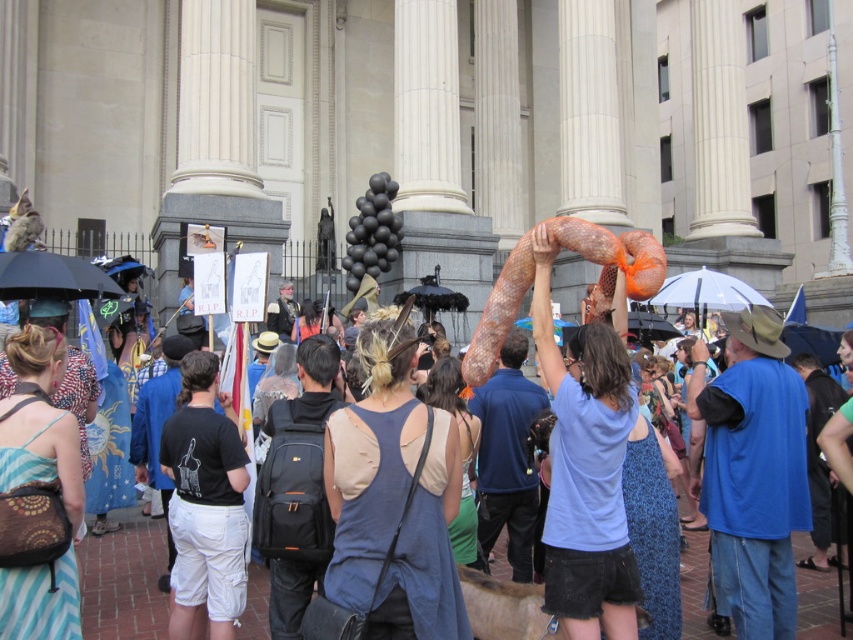
Question: Is the position of light blue cotton shirt at upper center more distant than that of black matte umbrella at left?

Choices:
 (A) yes
 (B) no

Answer: (B)

Question: Can you confirm if light blue cotton shirt at upper center is positioned below black matte umbrella at left?

Choices:
 (A) no
 (B) yes

Answer: (B)

Question: Based on their relative distances, which object is nearer to the transparent plastic umbrella at upper center?

Choices:
 (A) black matte umbrella at left
 (B) light blue cotton shirt at upper center

Answer: (B)

Question: Considering the relative positions of black matte umbrella at left and transparent plastic umbrella at upper center in the image provided, where is black matte umbrella at left located with respect to transparent plastic umbrella at upper center?

Choices:
 (A) below
 (B) above

Answer: (A)

Question: Considering the real-world distances, which object is farthest from the black matte umbrella at left?

Choices:
 (A) light blue cotton shirt at upper center
 (B) transparent plastic umbrella at upper center

Answer: (B)

Question: Considering the real-world distances, which object is farthest from the black matte umbrella at left?

Choices:
 (A) light blue cotton shirt at upper center
 (B) transparent plastic umbrella at upper center

Answer: (B)